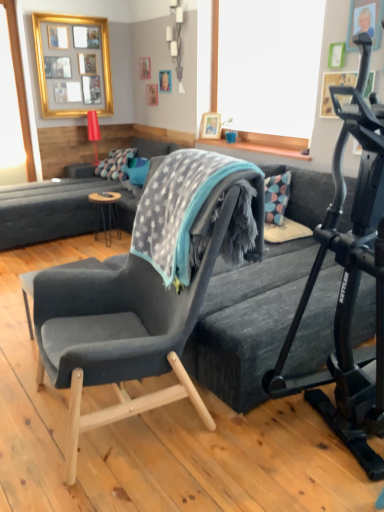
This screenshot has height=512, width=384. I want to click on black metal treadmill at right, so click(349, 284).

Describe the element at coordinates (129, 320) in the screenshot. This screenshot has height=512, width=384. I see `velvet dark gray armchair at center` at that location.

Describe the element at coordinates (57, 208) in the screenshot. The width and height of the screenshot is (384, 512). I see `velvet dark gray couch at center` at that location.

Locate an element on the screen. The height and width of the screenshot is (512, 384). velvet dark gray couch at center is located at coordinates (57, 208).

This screenshot has height=512, width=384. What do you see at coordinates (177, 208) in the screenshot? I see `gray fleece blanket at center` at bounding box center [177, 208].

In order to face teal fabric pillow at center, which is the 1th pillow from right to left, should I rotate leftwards or rightwards?

Turn left by 6.495 degrees to look at teal fabric pillow at center, which is the 1th pillow from right to left.

What do you see at coordinates (104, 212) in the screenshot?
I see `wooden black table at center` at bounding box center [104, 212].

Identify the location of black metal treadmill at right. This screenshot has height=512, width=384. (349, 284).

Relative to multicolored fabric pillow at center, positioned as the 1th pillow in left-to-right order, is teal fabric pillow at center, which is the 1th pillow from right to left, in front or behind?

teal fabric pillow at center, which is the 1th pillow from right to left, is in front of multicolored fabric pillow at center, positioned as the 1th pillow in left-to-right order.

Could you tell me if teal fabric pillow at center, acting as the second pillow starting from the left, is turned towards multicolored fabric pillow at center, positioned as the 1th pillow in left-to-right order?

No, teal fabric pillow at center, acting as the second pillow starting from the left, is not aimed at multicolored fabric pillow at center, positioned as the 1th pillow in left-to-right order.

Do you think teal fabric pillow at center, acting as the second pillow starting from the left, is within multicolored fabric pillow at center, positioned as the second pillow in right-to-left order, or outside of it?

teal fabric pillow at center, acting as the second pillow starting from the left, is located beyond the bounds of multicolored fabric pillow at center, positioned as the second pillow in right-to-left order.

Between teal fabric pillow at center, acting as the second pillow starting from the left, and multicolored fabric pillow at center, positioned as the 1th pillow in left-to-right order, which one has more height?

multicolored fabric pillow at center, positioned as the 1th pillow in left-to-right order.

Which is in front, gray fleece blanket at center or wooden black table at center?

Positioned in front is gray fleece blanket at center.

Choose the correct answer: Is gray fleece blanket at center inside wooden black table at center or outside it?

gray fleece blanket at center is spatially situated outside wooden black table at center.

Which of these two, gray fleece blanket at center or wooden black table at center, stands taller?

With more height is gray fleece blanket at center.

Is gray fleece blanket at center far away from wooden black table at center?

Yes, gray fleece blanket at center and wooden black table at center are located far from each other.

Which of these two, gold metallic picture frame at upper left or velvet dark gray armchair at center, stands taller?

velvet dark gray armchair at center.

Is gold metallic picture frame at upper left placed right next to velvet dark gray armchair at center?

No, gold metallic picture frame at upper left is not touching velvet dark gray armchair at center.

Does gold metallic picture frame at upper left turn towards velvet dark gray armchair at center?

Yes, gold metallic picture frame at upper left is turned towards velvet dark gray armchair at center.

From a real-world perspective, is black metal treadmill at right positioned over velvet dark gray armchair at center based on gravity?

Indeed, from a real-world perspective, black metal treadmill at right stands above velvet dark gray armchair at center.

Which of these two, black metal treadmill at right or velvet dark gray armchair at center, stands taller?

Standing taller between the two is black metal treadmill at right.

Is black metal treadmill at right turned away from velvet dark gray armchair at center?

No, black metal treadmill at right is not facing away from velvet dark gray armchair at center.

Is black metal treadmill at right far away from velvet dark gray armchair at center?

No.

Which is behind, point (110, 225) or point (122, 152)?

Positioned behind is point (122, 152).

Which of these two, wooden black table at center or multicolored fabric pillow at center, positioned as the 1th pillow in left-to-right order, is wider?

multicolored fabric pillow at center, positioned as the 1th pillow in left-to-right order.

Which is behind, wooden black table at center or multicolored fabric pillow at center, positioned as the second pillow in right-to-left order?

multicolored fabric pillow at center, positioned as the second pillow in right-to-left order, is further from the camera.

Considering the positions of objects gold metallic picture frame at upper left and velvet dark gray couch at center in the image provided, who is more to the right, gold metallic picture frame at upper left or velvet dark gray couch at center?

From the viewer's perspective, velvet dark gray couch at center appears more on the right side.

From their relative heights in the image, would you say gold metallic picture frame at upper left is taller or shorter than velvet dark gray couch at center?

Clearly, gold metallic picture frame at upper left is taller compared to velvet dark gray couch at center.

Is velvet dark gray couch at center at the back of gold metallic picture frame at upper left?

No.

Which is further, [70,79] or [36,183]?

Positioned behind is point [70,79].

Considering the sizes of velvet dark gray armchair at center and gold metallic picture frame at upper left in the image, is velvet dark gray armchair at center taller or shorter than gold metallic picture frame at upper left?

Considering their sizes, velvet dark gray armchair at center has more height than gold metallic picture frame at upper left.

Is velvet dark gray armchair at center positioned behind gold metallic picture frame at upper left?

No, velvet dark gray armchair at center is in front of gold metallic picture frame at upper left.

Between velvet dark gray armchair at center and gold metallic picture frame at upper left, which one appears on the left side from the viewer's perspective?

Positioned to the left is gold metallic picture frame at upper left.

Which is behind, point (46, 298) or point (88, 83)?

Point (88, 83)

At what (x,y) coordinates should I click in order to perform the action: click on pillow lying on the right of multicolored fabric pillow at center, positioned as the 1th pillow in left-to-right order. Please return your answer as a coordinate pair (x, y). This screenshot has height=512, width=384. Looking at the image, I should click on (138, 174).

Where is `table above the gray fleece blanket at center (from the image's perspective)`? table above the gray fleece blanket at center (from the image's perspective) is located at coordinates (104, 212).

Based on their spatial positions, is multicolored fabric pillow at center, positioned as the second pillow in right-to-left order, or velvet dark gray couch at center closer to teal fabric pillow at center, which is the 1th pillow from right to left?

Based on the image, multicolored fabric pillow at center, positioned as the second pillow in right-to-left order, appears to be nearer to teal fabric pillow at center, which is the 1th pillow from right to left.

Looking at the image, which one is located further to gray fleece blanket at center, black metal treadmill at right or gold metallic picture frame at upper left?

gold metallic picture frame at upper left is further to gray fleece blanket at center.

Looking at the image, which one is located closer to black metal treadmill at right, velvet dark gray armchair at center or velvet dark gray couch at center?

velvet dark gray armchair at center lies closer to black metal treadmill at right than the other object.

Estimate the real-world distances between objects in this image. Which object is closer to black metal treadmill at right, gray fleece blanket at center or multicolored fabric pillow at center, positioned as the 1th pillow in left-to-right order?

The object closer to black metal treadmill at right is gray fleece blanket at center.

Looking at this image, considering their positions, is gold metallic picture frame at upper left positioned closer to velvet dark gray armchair at center than gray fleece blanket at center?

Based on the image, gray fleece blanket at center appears to be nearer to velvet dark gray armchair at center.

Considering their positions, is gray fleece blanket at center positioned closer to velvet dark gray couch at center than wooden black table at center?

wooden black table at center is positioned closer to the anchor velvet dark gray couch at center.

Considering their positions, is multicolored fabric pillow at center, positioned as the 1th pillow in left-to-right order, positioned closer to black metal treadmill at right than wooden black table at center?

wooden black table at center is positioned closer to the anchor black metal treadmill at right.

Considering their positions, is velvet dark gray armchair at center positioned further to teal fabric pillow at center, acting as the second pillow starting from the left, than black metal treadmill at right?

Among the two, black metal treadmill at right is located further to teal fabric pillow at center, acting as the second pillow starting from the left.

This screenshot has width=384, height=512. I want to click on table between black metal treadmill at right and gold metallic picture frame at upper left from front to back, so click(x=104, y=212).

Find the location of a particular element. picture frame between velvet dark gray armchair at center and multicolored fabric pillow at center, positioned as the second pillow in right-to-left order, in the front-back direction is located at coordinates (73, 65).

Locate an element on the screen. The height and width of the screenshot is (512, 384). table between black metal treadmill at right and multicolored fabric pillow at center, positioned as the second pillow in right-to-left order, along the z-axis is located at coordinates (104, 212).

Identify the location of blanket located between black metal treadmill at right and wooden black table at center in the depth direction. Image resolution: width=384 pixels, height=512 pixels. (177, 208).